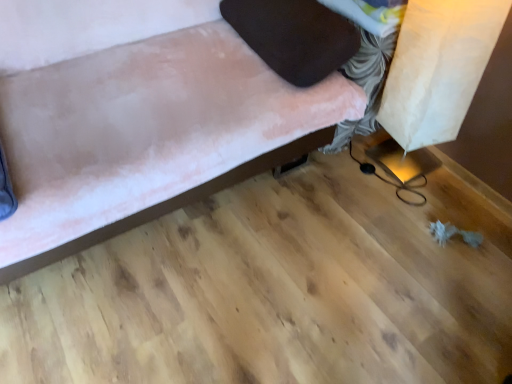
Find the location of a particular element. velvet pink couch at upper left is located at coordinates (161, 125).

In order to face velvet pink couch at upper left, should I rotate leftwards or rightwards?

To align with it, rotate left about 14.541°.

What do you see at coordinates (161, 125) in the screenshot?
I see `velvet pink couch at upper left` at bounding box center [161, 125].

This screenshot has height=384, width=512. What do you see at coordinates (294, 36) in the screenshot?
I see `velvet brown pillow at upper right` at bounding box center [294, 36].

Where is `velvet brown pillow at upper right`? Image resolution: width=512 pixels, height=384 pixels. velvet brown pillow at upper right is located at coordinates (294, 36).

Find the location of a particular element. This screenshot has width=512, height=384. velvet pink couch at upper left is located at coordinates (161, 125).

In the scene shown: Which is more to the left, velvet brown pillow at upper right or velvet pink couch at upper left?

velvet pink couch at upper left.

Relative to velvet pink couch at upper left, is velvet brown pillow at upper right in front or behind?

In the image, velvet brown pillow at upper right appears behind velvet pink couch at upper left.

Which point is more forward, [260,49] or [63,150]?

The point [63,150] is closer.

From the image's perspective, is velvet brown pillow at upper right below velvet pink couch at upper left?

Incorrect, from the image's perspective, velvet brown pillow at upper right is higher than velvet pink couch at upper left.

From a real-world perspective, who is located higher, velvet brown pillow at upper right or velvet pink couch at upper left?

velvet brown pillow at upper right.

Which object is wider, velvet brown pillow at upper right or velvet pink couch at upper left?

velvet pink couch at upper left is wider.

From their relative heights in the image, would you say velvet brown pillow at upper right is taller or shorter than velvet pink couch at upper left?

In the image, velvet brown pillow at upper right appears to be shorter than velvet pink couch at upper left.

Does velvet brown pillow at upper right have a larger size compared to velvet pink couch at upper left?

Incorrect, velvet brown pillow at upper right is not larger than velvet pink couch at upper left.

Looking at this image, is velvet pink couch at upper left completely or partially inside velvet brown pillow at upper right?

No, velvet brown pillow at upper right does not contain velvet pink couch at upper left.

Is velvet brown pillow at upper right in contact with velvet pink couch at upper left?

No.

Based on the photo, is velvet brown pillow at upper right looking in the opposite direction of velvet pink couch at upper left?

Absolutely, velvet brown pillow at upper right is directed away from velvet pink couch at upper left.

How different are the orientations of velvet brown pillow at upper right and velvet pink couch at upper left in degrees?

There is a 3.75e-05-degree angle between the facing directions of velvet brown pillow at upper right and velvet pink couch at upper left.

Identify the location of furniture located in front of the velvet brown pillow at upper right. The height and width of the screenshot is (384, 512). (161, 125).

Considering the positions of objects velvet pink couch at upper left and velvet brown pillow at upper right in the image provided, who is more to the right, velvet pink couch at upper left or velvet brown pillow at upper right?

velvet brown pillow at upper right is more to the right.

Is velvet pink couch at upper left closer to camera compared to velvet brown pillow at upper right?

Yes, velvet pink couch at upper left is closer to the camera.

Between point (145, 168) and point (290, 71), which one is positioned behind?

The point (290, 71) is behind.

From the image's perspective, is velvet pink couch at upper left beneath velvet brown pillow at upper right?

Yes, from the image's perspective, velvet pink couch at upper left is beneath velvet brown pillow at upper right.

From a real-world perspective, who is located lower, velvet pink couch at upper left or velvet brown pillow at upper right?

velvet pink couch at upper left is physically lower.

Which of these two, velvet pink couch at upper left or velvet brown pillow at upper right, is thinner?

velvet brown pillow at upper right.

Does velvet pink couch at upper left have a greater height compared to velvet brown pillow at upper right?

Yes, velvet pink couch at upper left is taller than velvet brown pillow at upper right.

Based on their sizes in the image, would you say velvet pink couch at upper left is bigger or smaller than velvet brown pillow at upper right?

Clearly, velvet pink couch at upper left is larger in size than velvet brown pillow at upper right.

Can we say velvet pink couch at upper left lies outside velvet brown pillow at upper right?

Yes, velvet pink couch at upper left is located beyond the bounds of velvet brown pillow at upper right.

Is velvet pink couch at upper left placed right next to velvet brown pillow at upper right?

No, velvet pink couch at upper left is not touching velvet brown pillow at upper right.

Consider the image. Could you tell me if velvet pink couch at upper left is turned towards velvet brown pillow at upper right?

No, velvet pink couch at upper left is not aimed at velvet brown pillow at upper right.

What's the angular difference between velvet pink couch at upper left and velvet brown pillow at upper right's facing directions?

The angle between the facing direction of velvet pink couch at upper left and the facing direction of velvet brown pillow at upper right is 3.75e-05 degrees.

Identify the location of pillow lying above the velvet pink couch at upper left (from the image's perspective). This screenshot has width=512, height=384. (294, 36).

Locate an element on the screen. furniture in front of the velvet brown pillow at upper right is located at coordinates (161, 125).

Locate an element on the screen. The image size is (512, 384). furniture on the left of velvet brown pillow at upper right is located at coordinates (161, 125).